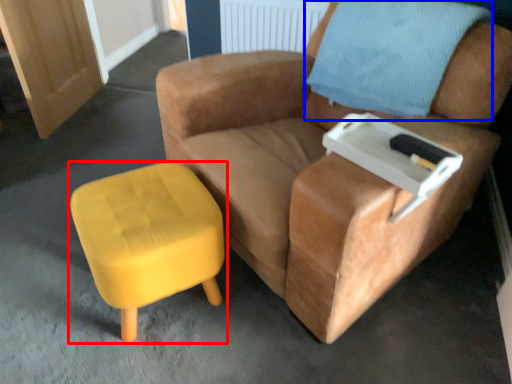
Question: Which object appears farthest to the camera in this image, stool (highlighted by a red box) or pillow (highlighted by a blue box)?

Choices:
 (A) stool
 (B) pillow

Answer: (B)